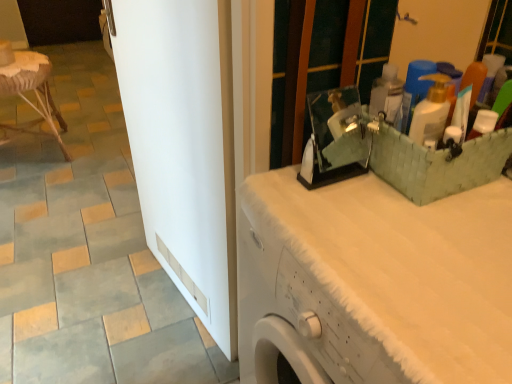
Question: Is gray matte tile at lower left positioned beyond the bounds of white textured counter top at upper right?

Choices:
 (A) no
 (B) yes

Answer: (B)

Question: Is gray matte tile at lower left oriented away from white textured counter top at upper right?

Choices:
 (A) no
 (B) yes

Answer: (A)

Question: Does gray matte tile at lower left appear on the right side of white textured counter top at upper right?

Choices:
 (A) yes
 (B) no

Answer: (B)

Question: Does gray matte tile at lower left come behind white textured counter top at upper right?

Choices:
 (A) yes
 (B) no

Answer: (A)

Question: Is gray matte tile at lower left positioned far away from white textured counter top at upper right?

Choices:
 (A) yes
 (B) no

Answer: (B)

Question: From a real-world perspective, relative to white glossy door at center, is rattan stool at left vertically above or below?

Choices:
 (A) above
 (B) below

Answer: (B)

Question: Would you say rattan stool at left is to the left or to the right of white glossy door at center in the picture?

Choices:
 (A) right
 (B) left

Answer: (B)

Question: Considering the positions of rattan stool at left and white glossy door at center in the image, is rattan stool at left taller or shorter than white glossy door at center?

Choices:
 (A) short
 (B) tall

Answer: (A)

Question: Is rattan stool at left inside the boundaries of white glossy door at center, or outside?

Choices:
 (A) outside
 (B) inside

Answer: (A)

Question: From a real-world perspective, is white glossy door at center positioned above or below rattan stool at left?

Choices:
 (A) above
 (B) below

Answer: (A)

Question: From the image's perspective, is white glossy door at center positioned above or below rattan stool at left?

Choices:
 (A) above
 (B) below

Answer: (B)

Question: Considering the positions of white glossy door at center and rattan stool at left in the image, is white glossy door at center bigger or smaller than rattan stool at left?

Choices:
 (A) small
 (B) big

Answer: (A)

Question: In the image, is white glossy door at center positioned in front of or behind rattan stool at left?

Choices:
 (A) behind
 (B) front

Answer: (B)

Question: Does point (80, 375) appear closer or farther from the camera than point (32, 105)?

Choices:
 (A) closer
 (B) farther

Answer: (A)

Question: Would you say gray matte tile at lower left is inside or outside rattan stool at left?

Choices:
 (A) inside
 (B) outside

Answer: (B)